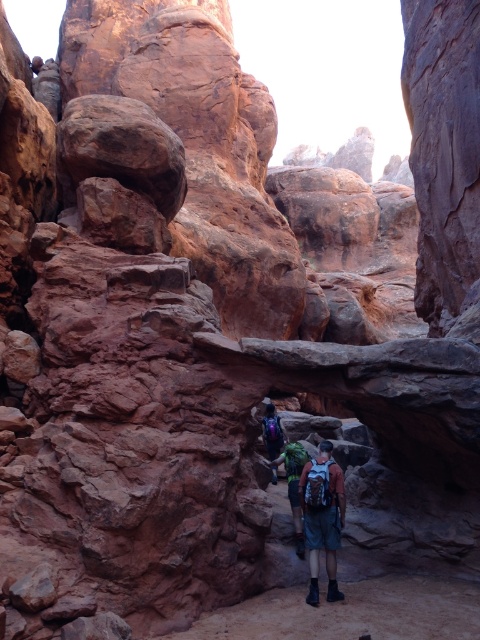
Question: From the image, what is the correct spatial relationship of matte blue shorts at center in relation to blue backpack at center?

Choices:
 (A) left
 (B) right

Answer: (B)

Question: Which point appears closest to the camera in this image?

Choices:
 (A) (272, 477)
 (B) (297, 541)

Answer: (B)

Question: Which of these objects is positioned farthest from the matte purple backpack at center?

Choices:
 (A) blue backpack at center
 (B) matte blue shorts at center

Answer: (B)

Question: Does matte blue shorts at center have a greater width compared to matte purple backpack at center?

Choices:
 (A) yes
 (B) no

Answer: (B)

Question: Can you confirm if matte blue shorts at center is bigger than blue backpack at center?

Choices:
 (A) no
 (B) yes

Answer: (A)

Question: Which object is farther from the camera taking this photo?

Choices:
 (A) matte blue shorts at center
 (B) matte purple backpack at center
 (C) blue backpack at center

Answer: (B)